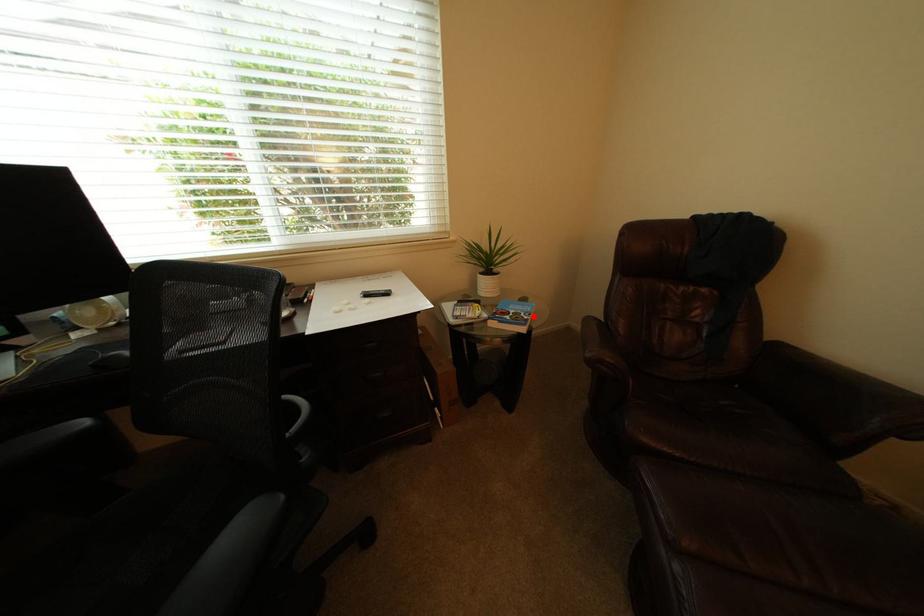
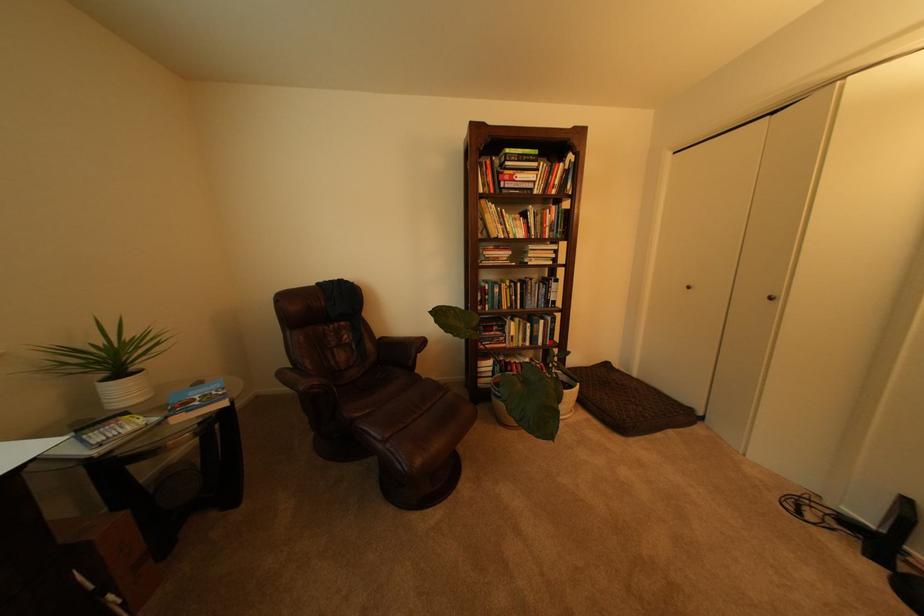
Question: I am providing you with two images of the same scene from different viewpoints. A red point is marked on the first image. At the location where the point appears in image 1, is it still visible in image 2?

Choices:
 (A) Yes
 (B) No

Answer: (A)